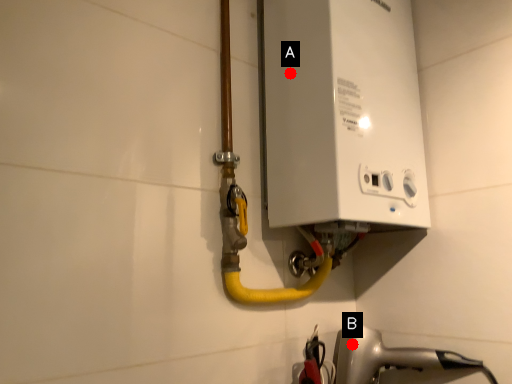
Question: Two points are circled on the image, labeled by A and B beside each circle. Which point appears farthest from the camera in this image?

Choices:
 (A) A is further
 (B) B is further

Answer: (B)